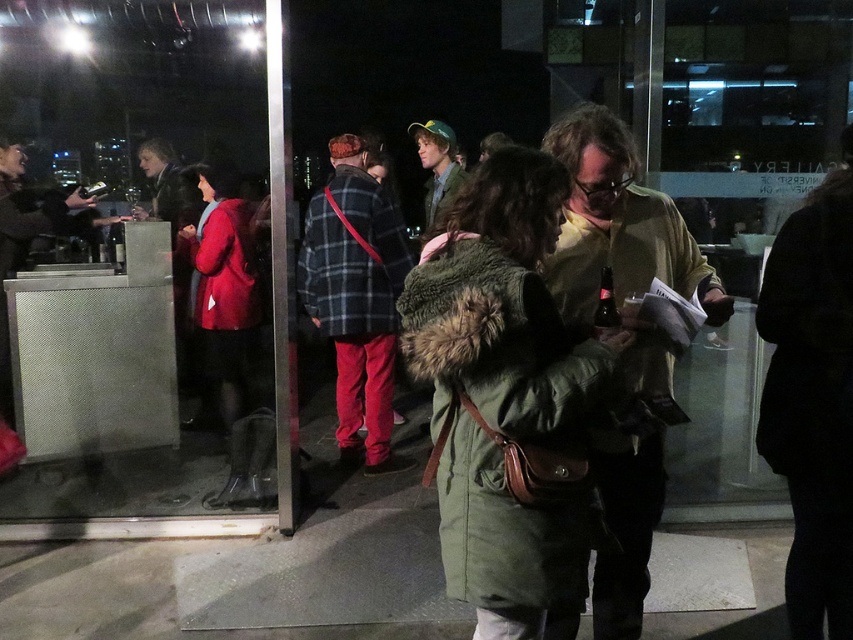
Between plaid wool jacket at center and green woolen hat at center, which one is positioned higher?

green woolen hat at center is above.

Between plaid wool jacket at center and green woolen hat at center, which one is positioned lower?

Positioned lower is plaid wool jacket at center.

Identify the location of plaid wool jacket at center. This screenshot has width=853, height=640. (357, 298).

Between matte yellow shirt at center and matte red coat at center, which one is positioned higher?

matte red coat at center

Between matte yellow shirt at center and matte red coat at center, which one has less height?

matte red coat at center is shorter.

Where is `matte yellow shirt at center`? matte yellow shirt at center is located at coordinates (618, 225).

The height and width of the screenshot is (640, 853). Identify the location of matte yellow shirt at center. (618, 225).

In the scene shown: Which is above, green fuzzy coat at center or green woolen hat at center?

Positioned higher is green woolen hat at center.

This screenshot has height=640, width=853. Describe the element at coordinates (506, 397) in the screenshot. I see `green fuzzy coat at center` at that location.

You are a GUI agent. You are given a task and a screenshot of the screen. Output one action in this format:
    pyautogui.click(x=<x>, y=<y>)
    Task: Click on the green fuzzy coat at center
    The height and width of the screenshot is (640, 853).
    Given the screenshot: What is the action you would take?
    pyautogui.click(x=506, y=397)